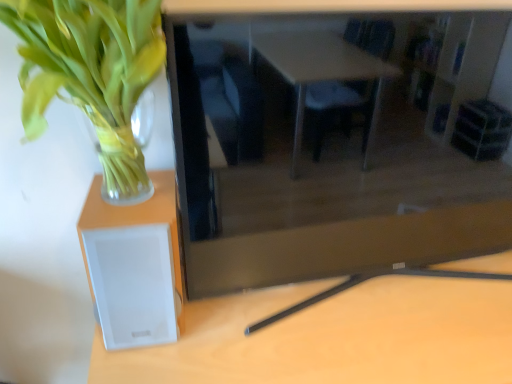
Locate an element on the screen. The width and height of the screenshot is (512, 384). free point above white matte speaker at left (from a real-world perspective) is located at coordinates (131, 191).